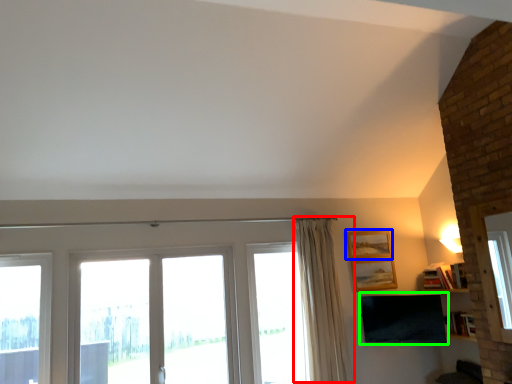
Question: Which object is the farthest from curtain (highlighted by a red box)? Choose among these: picture frame (highlighted by a blue box) or television (highlighted by a green box).

Choices:
 (A) picture frame
 (B) television

Answer: (A)